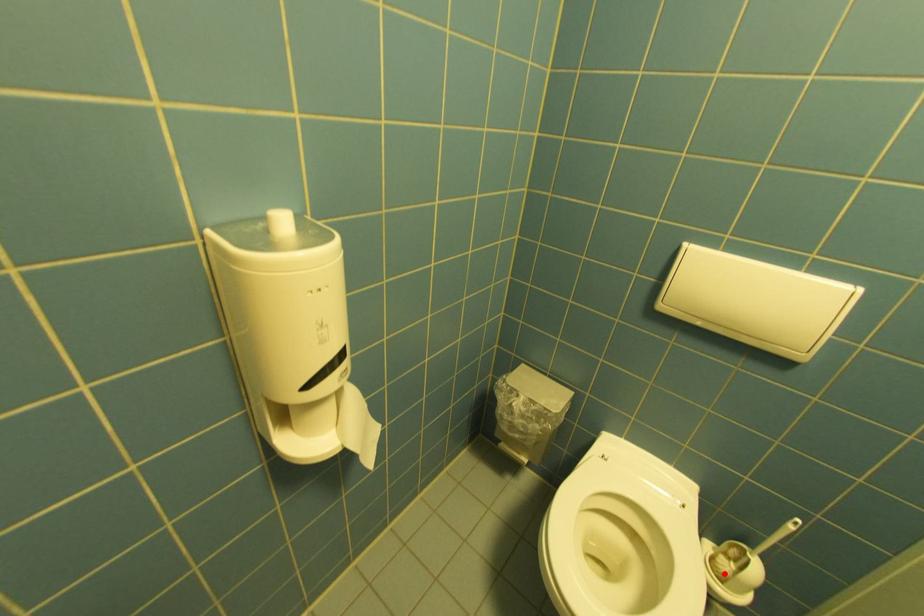
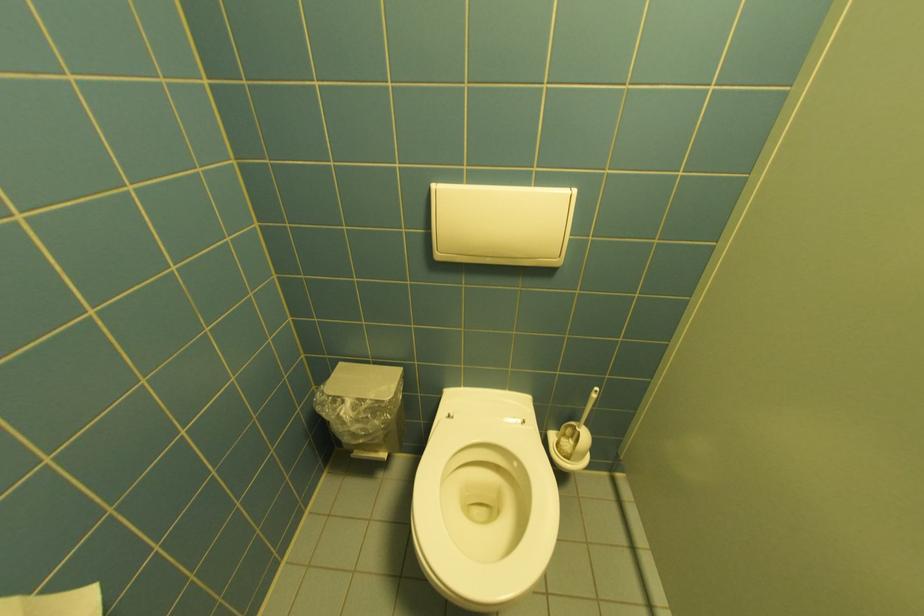
Question: I am providing you with two images of the same scene from different viewpoints. A red point is shown in image1. For the corresponding object point in image2, is it positioned nearer or farther from the camera?

Choices:
 (A) Nearer
 (B) Farther

Answer: (B)